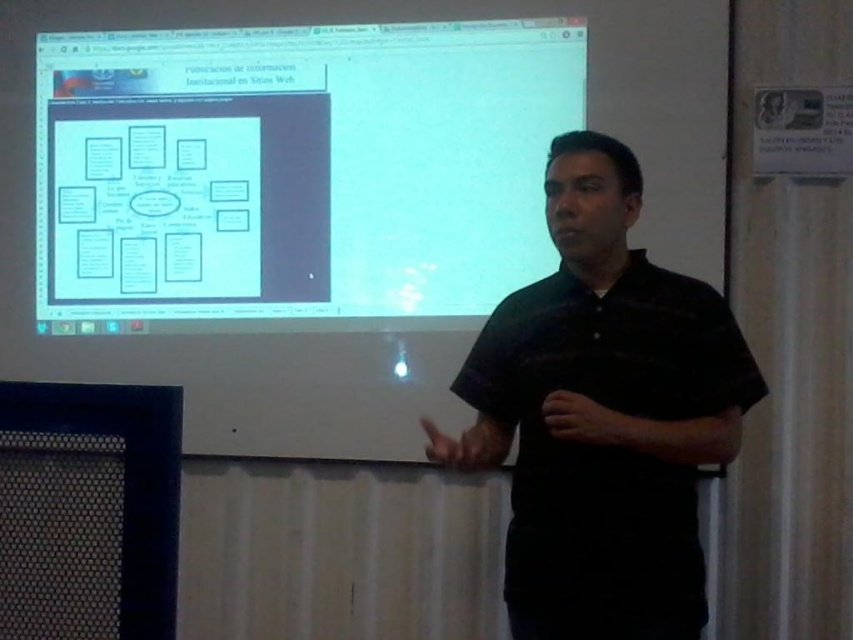
Question: Which point appears closest to the camera in this image?

Choices:
 (A) (370, 33)
 (B) (595, 602)

Answer: (B)

Question: Can you confirm if white matte projection screen at upper center is positioned below black striped shirt at center?

Choices:
 (A) yes
 (B) no

Answer: (B)

Question: Which of the following is the closest to the observer?

Choices:
 (A) (697, 330)
 (B) (184, 108)

Answer: (A)

Question: Is white matte projection screen at upper center below black striped shirt at center?

Choices:
 (A) no
 (B) yes

Answer: (A)

Question: Is the position of white matte projection screen at upper center more distant than that of black striped shirt at center?

Choices:
 (A) no
 (B) yes

Answer: (B)